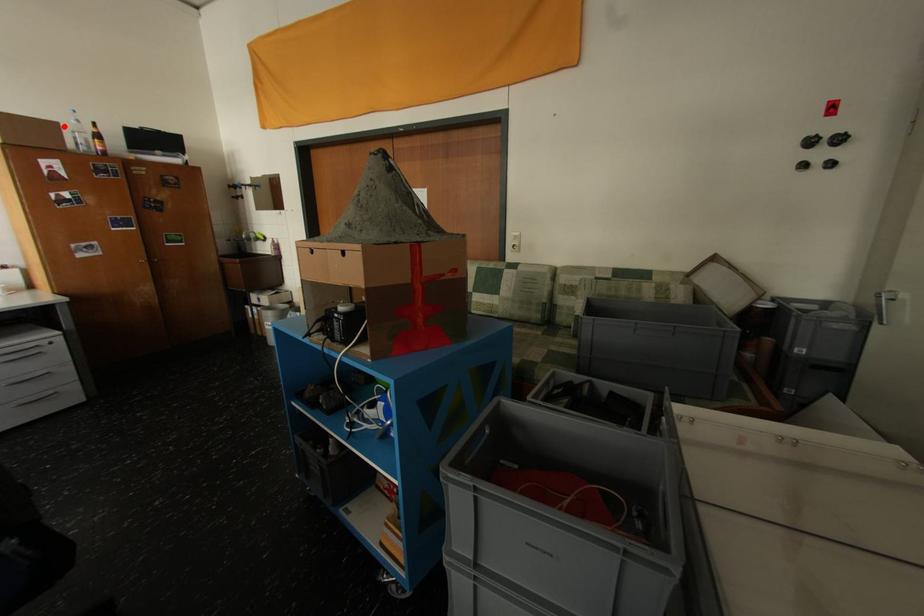
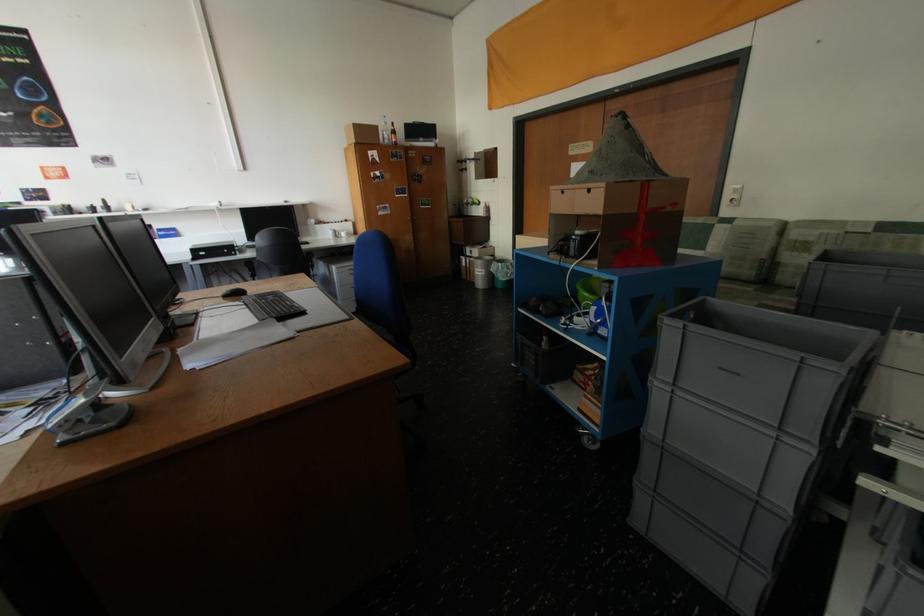
The point at the highlighted location is marked in the first image. Where is the corresponding point in the second image?

(384, 129)